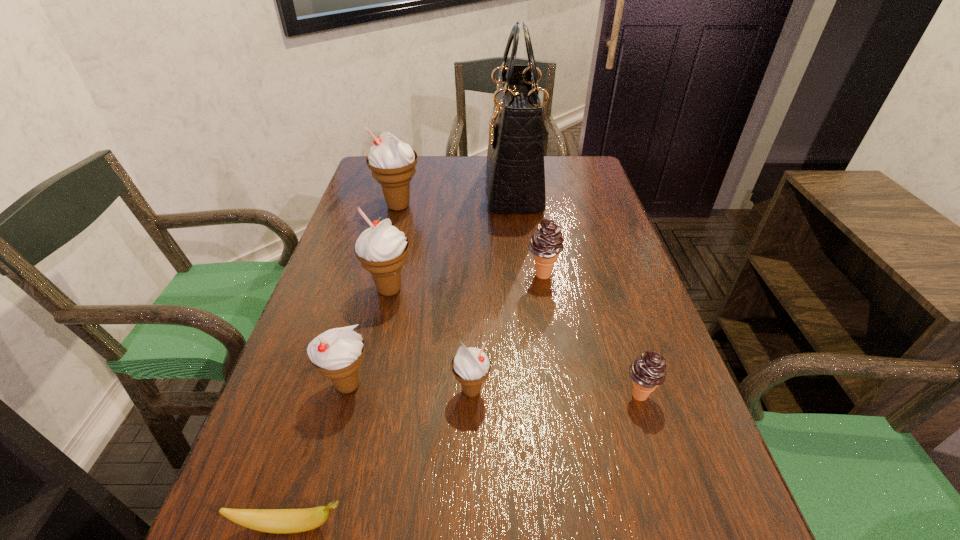
Locate an element on the screen. This screenshot has width=960, height=540. handbag is located at coordinates (515, 158).

Locate an element on the screen. Image resolution: width=960 pixels, height=540 pixels. the tallest icecream is located at coordinates (392, 163).

Find the location of `the farthest icecream`. the farthest icecream is located at coordinates (392, 163).

At what (x,y) coordinates should I click in order to perform the action: click on the third smallest white icecream. Please return your answer as a coordinate pair (x, y). The image size is (960, 540). Looking at the image, I should click on (382, 249).

What are the coordinates of `the sixth shortest object` in the screenshot? It's located at (382, 249).

Locate an element on the screen. the farther chocolate icecream is located at coordinates (546, 243).

At what (x,y) coordinates should I click in order to perform the action: click on the fifth icecream from left to right. Please return your answer as a coordinate pair (x, y). This screenshot has width=960, height=540. Looking at the image, I should click on [x=546, y=243].

Find the location of a particular element. This screenshot has height=540, width=960. the second smallest white icecream is located at coordinates (337, 353).

At what (x,y) coordinates should I click in order to perform the action: click on the fourth object from right to left. Please return your answer as a coordinate pair (x, y). Looking at the image, I should click on (470, 366).

Identify the location of the fourth icecream from left to right. This screenshot has width=960, height=540. (470, 366).